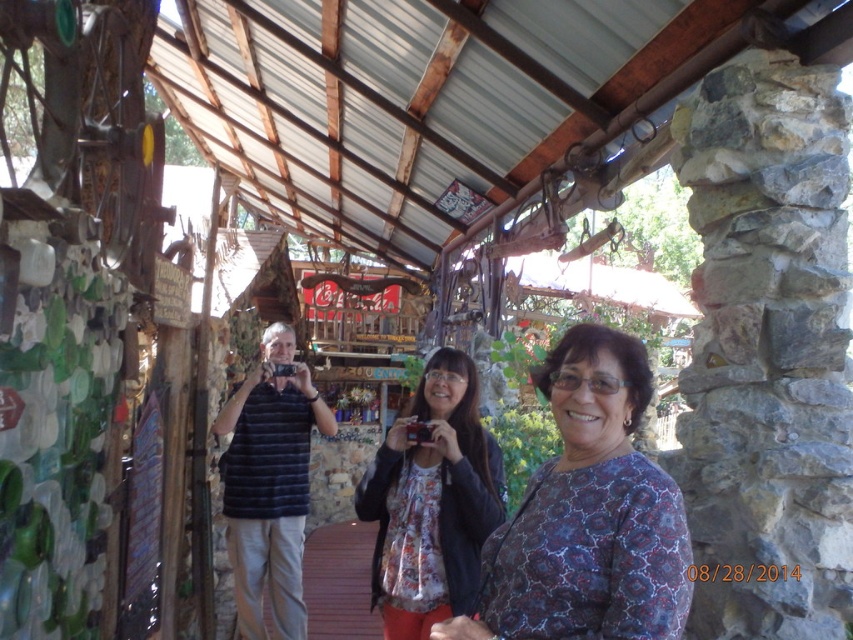
Who is more distant from viewer, (560, 401) or (282, 589)?

The point (282, 589) is behind.

Is blue patterned blouse at center positioned before dark blue striped shirt at center?

Yes, blue patterned blouse at center is closer to the viewer.

Does point (599, 621) come farther from viewer compared to point (259, 540)?

That is False.

At what (x,y) coordinates should I click in order to perform the action: click on blue patterned blouse at center. Please return your answer as a coordinate pair (x, y). The image size is (853, 640). Looking at the image, I should click on 589,515.

In the scene shown: Does blue patterned blouse at center have a larger size compared to floral fabric blouse at center?

Actually, blue patterned blouse at center might be smaller than floral fabric blouse at center.

Which is below, blue patterned blouse at center or floral fabric blouse at center?

floral fabric blouse at center is below.

Find the location of a particular element. blue patterned blouse at center is located at coordinates (589, 515).

Can you confirm if floral fabric blouse at center is wider than dark blue striped shirt at center?

Incorrect, floral fabric blouse at center's width does not surpass dark blue striped shirt at center's.

Is point (437, 529) positioned in front of point (235, 564)?

That is True.

You are a GUI agent. You are given a task and a screenshot of the screen. Output one action in this format:
    pyautogui.click(x=<x>, y=<y>)
    Task: Click on the floral fabric blouse at center
    The image size is (853, 640).
    Given the screenshot: What is the action you would take?
    pyautogui.click(x=432, y=502)